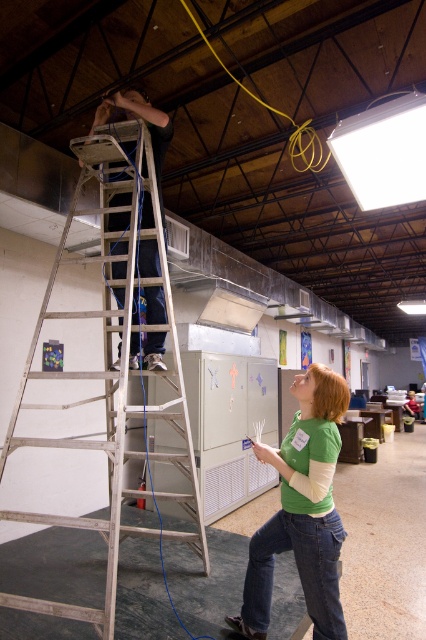
Question: Does green matte shirt at lower center have a larger size compared to matte black ladder at upper left?

Choices:
 (A) yes
 (B) no

Answer: (B)

Question: In this image, where is silver metallic ladder at upper left located relative to green matte shirt at lower center?

Choices:
 (A) left
 (B) right

Answer: (A)

Question: Which object appears closest to the camera in this image?

Choices:
 (A) matte black ladder at upper left
 (B) silver metallic ladder at upper left

Answer: (B)

Question: Estimate the real-world distances between objects in this image. Which object is closer to the silver metallic ladder at upper left?

Choices:
 (A) matte black ladder at upper left
 (B) green matte shirt at lower center

Answer: (A)

Question: Which object is the closest to the matte black ladder at upper left?

Choices:
 (A) green matte shirt at lower center
 (B) silver metallic ladder at upper left

Answer: (B)

Question: Can you confirm if silver metallic ladder at upper left is positioned below green matte shirt at lower center?

Choices:
 (A) no
 (B) yes

Answer: (A)